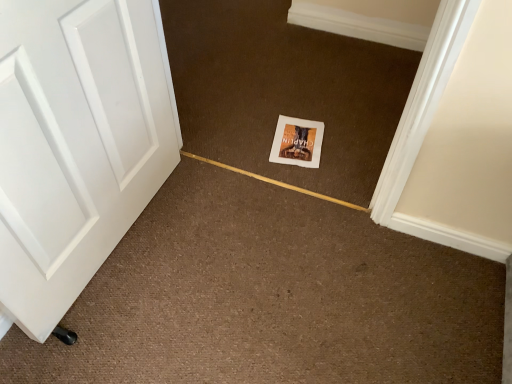
The width and height of the screenshot is (512, 384). Identify the location of free space in front of white paper postcard at center. (314, 175).